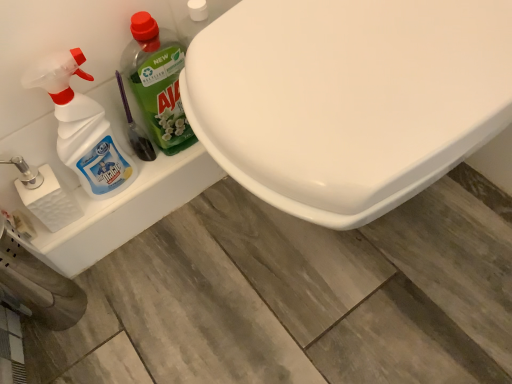
Locate an element on the screen. green plastic bottle at left, the 2th cleaning product from the left is located at coordinates (157, 82).

The image size is (512, 384). What are the coordinates of `white glossy toilet at center` in the screenshot? It's located at (348, 98).

Where is `green plastic bottle at left, the 2th cleaning product from the left`? The width and height of the screenshot is (512, 384). green plastic bottle at left, the 2th cleaning product from the left is located at coordinates (157, 82).

Is white textured toilet paper at left spatially inside translucent plastic spray bottle at left, which is the 2th cleaning product in right-to-left order, or outside of it?

white textured toilet paper at left is not inside translucent plastic spray bottle at left, which is the 2th cleaning product in right-to-left order, it's outside.

Between white textured toilet paper at left and translucent plastic spray bottle at left, which is the 2th cleaning product in right-to-left order, which one has smaller width?

Thinner between the two is white textured toilet paper at left.

In the scene shown: From the image's perspective, which is below, white textured toilet paper at left or translucent plastic spray bottle at left, which is counted as the first cleaning product, starting from the left?

white textured toilet paper at left appears lower in the image.

What's the angular difference between white textured toilet paper at left and translucent plastic spray bottle at left, which is counted as the first cleaning product, starting from the left,'s facing directions?

white textured toilet paper at left and translucent plastic spray bottle at left, which is counted as the first cleaning product, starting from the left, are facing 1.45 degrees away from each other.

Looking at this image, which is behind, translucent plastic spray bottle at left, which is the 2th cleaning product in right-to-left order, or green plastic bottle at left, the 2th cleaning product from the left?

green plastic bottle at left, the 2th cleaning product from the left, is further from the camera.

Can you confirm if translucent plastic spray bottle at left, which is counted as the first cleaning product, starting from the left, is thinner than green plastic bottle at left, positioned as the 1th cleaning product in right-to-left order?

No, translucent plastic spray bottle at left, which is counted as the first cleaning product, starting from the left, is not thinner than green plastic bottle at left, positioned as the 1th cleaning product in right-to-left order.

From the image's perspective, is translucent plastic spray bottle at left, which is the 2th cleaning product in right-to-left order, located above or below green plastic bottle at left, positioned as the 1th cleaning product in right-to-left order?

Based on their image positions, translucent plastic spray bottle at left, which is the 2th cleaning product in right-to-left order, is located beneath green plastic bottle at left, positioned as the 1th cleaning product in right-to-left order.

Does translucent plastic spray bottle at left, which is counted as the first cleaning product, starting from the left, appear on the right side of green plastic bottle at left, the 2th cleaning product from the left?

In fact, translucent plastic spray bottle at left, which is counted as the first cleaning product, starting from the left, is to the left of green plastic bottle at left, the 2th cleaning product from the left.

Is white glossy toilet at center positioned with its back to translucent plastic spray bottle at left, which is counted as the first cleaning product, starting from the left?

No.

From the picture: Considering their positions, is white glossy toilet at center located in front of or behind translucent plastic spray bottle at left, which is counted as the first cleaning product, starting from the left?

Clearly, white glossy toilet at center is in front of translucent plastic spray bottle at left, which is counted as the first cleaning product, starting from the left.

Is white glossy toilet at center to the left or to the right of translucent plastic spray bottle at left, which is the 2th cleaning product in right-to-left order, in the image?

Based on their positions, white glossy toilet at center is located to the right of translucent plastic spray bottle at left, which is the 2th cleaning product in right-to-left order.

From a real-world perspective, which object rests below the other?

From a 3D spatial view, white glossy toilet at center is below.

Is point (158, 88) positioned after point (64, 221)?

No, it is in front of (64, 221).

Considering the sizes of green plastic bottle at left, positioned as the 1th cleaning product in right-to-left order, and white textured toilet paper at left in the image, is green plastic bottle at left, positioned as the 1th cleaning product in right-to-left order, taller or shorter than white textured toilet paper at left?

green plastic bottle at left, positioned as the 1th cleaning product in right-to-left order, is taller than white textured toilet paper at left.

Where is `cleaning product that is the 2nd one when counting rightward from the white textured toilet paper at left`? cleaning product that is the 2nd one when counting rightward from the white textured toilet paper at left is located at coordinates (157, 82).

In the scene shown: Which of these two, white glossy toilet at center or white textured toilet paper at left, stands taller?

white glossy toilet at center is taller.

Does white glossy toilet at center lie behind white textured toilet paper at left?

No, white glossy toilet at center is closer to the camera.

You are a GUI agent. You are given a task and a screenshot of the screen. Output one action in this format:
    pyautogui.click(x=<x>, y=<y>)
    Task: Click on the toilet paper behind the white glossy toilet at center
    This screenshot has height=384, width=512.
    Given the screenshot: What is the action you would take?
    pyautogui.click(x=50, y=201)

Considering the positions of point (226, 92) and point (55, 184), is point (226, 92) closer or farther from the camera than point (55, 184)?

Point (226, 92).

Is white glossy toilet at center outside of green plastic bottle at left, positioned as the 1th cleaning product in right-to-left order?

Yes, white glossy toilet at center is located beyond the bounds of green plastic bottle at left, positioned as the 1th cleaning product in right-to-left order.

From a real-world perspective, is white glossy toilet at center located beneath green plastic bottle at left, the 2th cleaning product from the left?

Correct, in the physical world, white glossy toilet at center is lower than green plastic bottle at left, the 2th cleaning product from the left.

Between point (468, 1) and point (166, 37), which one is positioned in front?

The point (468, 1) is closer to the camera.

Based on their sizes in the image, would you say white glossy toilet at center is bigger or smaller than green plastic bottle at left, positioned as the 1th cleaning product in right-to-left order?

In the image, white glossy toilet at center appears to be larger than green plastic bottle at left, positioned as the 1th cleaning product in right-to-left order.

Which of these two, translucent plastic spray bottle at left, which is the 2th cleaning product in right-to-left order, or white glossy toilet at center, is smaller?

translucent plastic spray bottle at left, which is the 2th cleaning product in right-to-left order.

Considering the points (72, 63) and (325, 144), which point is in front, point (72, 63) or point (325, 144)?

Positioned in front is point (325, 144).

Is translucent plastic spray bottle at left, which is counted as the first cleaning product, starting from the left, looking in the opposite direction of white glossy toilet at center?

That's not correct — translucent plastic spray bottle at left, which is counted as the first cleaning product, starting from the left, is not looking away from white glossy toilet at center.

From a real-world perspective, is translucent plastic spray bottle at left, which is counted as the first cleaning product, starting from the left, over white glossy toilet at center?

Yes, from a real-world perspective, translucent plastic spray bottle at left, which is counted as the first cleaning product, starting from the left, is above white glossy toilet at center.

Where is `toilet paper behind the translucent plastic spray bottle at left, which is counted as the first cleaning product, starting from the left`? The height and width of the screenshot is (384, 512). toilet paper behind the translucent plastic spray bottle at left, which is counted as the first cleaning product, starting from the left is located at coordinates (50, 201).

Identify the location of cleaning product above the translucent plastic spray bottle at left, which is counted as the first cleaning product, starting from the left (from the image's perspective). This screenshot has width=512, height=384. (157, 82).

Based on their spatial positions, is white textured toilet paper at left or green plastic bottle at left, the 2th cleaning product from the left, further from translucent plastic spray bottle at left, which is counted as the first cleaning product, starting from the left?

The object further to translucent plastic spray bottle at left, which is counted as the first cleaning product, starting from the left, is white textured toilet paper at left.

Estimate the real-world distances between objects in this image. Which object is closer to white textured toilet paper at left, green plastic bottle at left, positioned as the 1th cleaning product in right-to-left order, or white glossy toilet at center?

The object closer to white textured toilet paper at left is green plastic bottle at left, positioned as the 1th cleaning product in right-to-left order.

From the image, which object appears to be farther from white textured toilet paper at left, white glossy toilet at center or green plastic bottle at left, the 2th cleaning product from the left?

Based on the image, white glossy toilet at center appears to be further to white textured toilet paper at left.

Based on their spatial positions, is white glossy toilet at center or translucent plastic spray bottle at left, which is counted as the first cleaning product, starting from the left, closer to white textured toilet paper at left?

Based on the image, translucent plastic spray bottle at left, which is counted as the first cleaning product, starting from the left, appears to be nearer to white textured toilet paper at left.

Based on their spatial positions, is white glossy toilet at center or translucent plastic spray bottle at left, which is counted as the first cleaning product, starting from the left, closer to green plastic bottle at left, the 2th cleaning product from the left?

translucent plastic spray bottle at left, which is counted as the first cleaning product, starting from the left, lies closer to green plastic bottle at left, the 2th cleaning product from the left, than the other object.

Which object lies nearer to the anchor point white textured toilet paper at left, translucent plastic spray bottle at left, which is counted as the first cleaning product, starting from the left, or green plastic bottle at left, the 2th cleaning product from the left?

Among the two, translucent plastic spray bottle at left, which is counted as the first cleaning product, starting from the left, is located nearer to white textured toilet paper at left.

Consider the image. From the image, which object appears to be nearer to translucent plastic spray bottle at left, which is the 2th cleaning product in right-to-left order, green plastic bottle at left, positioned as the 1th cleaning product in right-to-left order, or white glossy toilet at center?

Based on the image, green plastic bottle at left, positioned as the 1th cleaning product in right-to-left order, appears to be nearer to translucent plastic spray bottle at left, which is the 2th cleaning product in right-to-left order.

Estimate the real-world distances between objects in this image. Which object is further from translucent plastic spray bottle at left, which is the 2th cleaning product in right-to-left order, white glossy toilet at center or green plastic bottle at left, positioned as the 1th cleaning product in right-to-left order?

Based on the image, white glossy toilet at center appears to be further to translucent plastic spray bottle at left, which is the 2th cleaning product in right-to-left order.

Locate an element on the screen. cleaning product between white textured toilet paper at left and green plastic bottle at left, positioned as the 1th cleaning product in right-to-left order, in the horizontal direction is located at coordinates (82, 127).

I want to click on cleaning product between translucent plastic spray bottle at left, which is the 2th cleaning product in right-to-left order, and white glossy toilet at center, in the horizontal direction, so tap(157, 82).